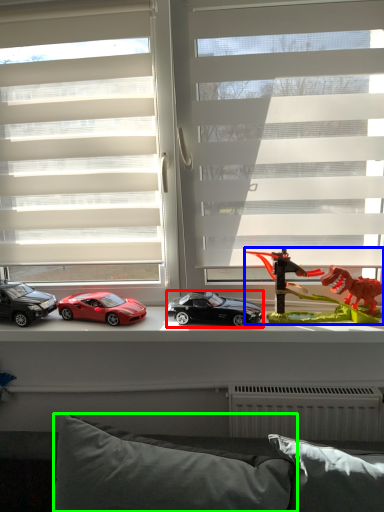
Question: Which object is the farthest from car (highlighted by a red box)? Choose among these: toy (highlighted by a blue box) or pillow (highlighted by a green box).

Choices:
 (A) toy
 (B) pillow

Answer: (B)